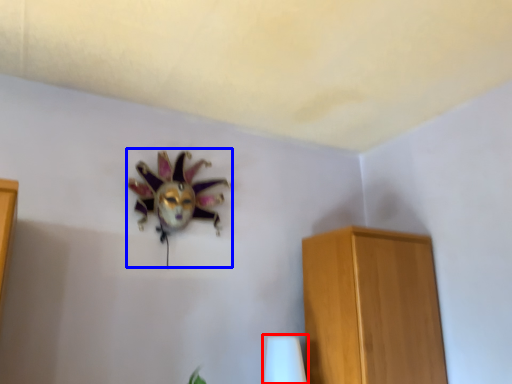
Question: Which point is further to the camera, table lamp (highlighted by a red box) or animal (highlighted by a blue box)?

Choices:
 (A) table lamp
 (B) animal

Answer: (A)